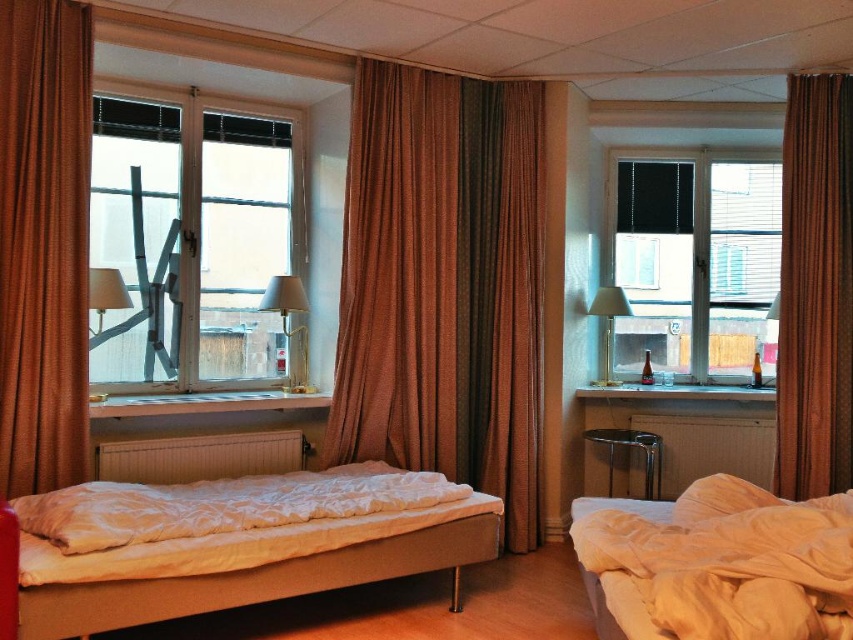
Question: Can you confirm if white fabric bed at left is bigger than white soft pillow at lower right?

Choices:
 (A) yes
 (B) no

Answer: (A)

Question: Based on their relative distances, which object is farther from the brown textured curtain at center?

Choices:
 (A) metallic gold table lamp at right
 (B) white soft bed at lower right

Answer: (B)

Question: Is white fabric bed at left closer to camera compared to brown textured curtain at right?

Choices:
 (A) yes
 (B) no

Answer: (A)

Question: Where is clear glass window at left located in relation to matte glass lamp at center in the image?

Choices:
 (A) left
 (B) right

Answer: (A)

Question: Which of the following is the closest to the observer?

Choices:
 (A) white soft pillow at lower right
 (B) white fabric bed at left
 (C) white soft bed at lower right

Answer: (C)

Question: Which object is the farthest from the matte glass lamp at center?

Choices:
 (A) clear glass window at left
 (B) brown textured curtain at right
 (C) white soft bed at lower right
 (D) white fabric bed at left

Answer: (B)